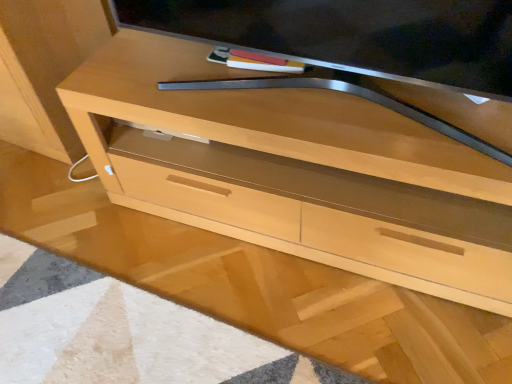
This screenshot has height=384, width=512. Find the location of `vacant space underneath satin silver tv at upper center (from a real-world perspective)`. vacant space underneath satin silver tv at upper center (from a real-world perspective) is located at coordinates (301, 93).